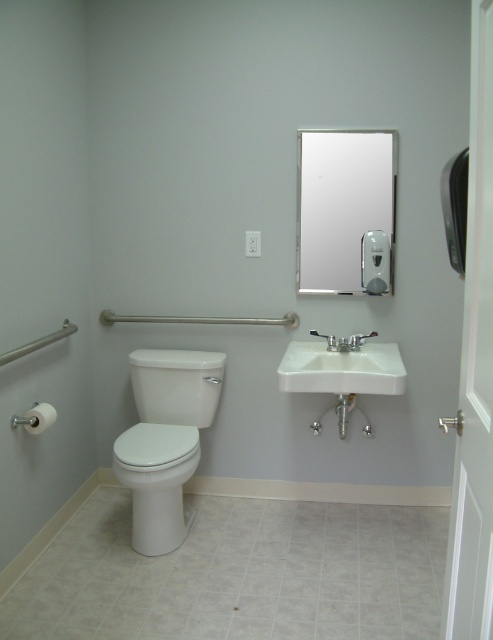
Question: Is clear glass mirror at upper center positioned before white matte toilet paper at lower left?

Choices:
 (A) yes
 (B) no

Answer: (B)

Question: In this image, where is white glossy toilet at lower left located relative to satin nickel faucet at sink right?

Choices:
 (A) right
 (B) left

Answer: (B)

Question: Which object appears closest to the camera in this image?

Choices:
 (A) silver metallic towel bar at lower left
 (B) satin nickel faucet at sink center
 (C) clear glass mirror at upper center
 (D) satin nickel faucet at sink right

Answer: (A)

Question: Which point is farther from the camera taking this photo?

Choices:
 (A) (313, 330)
 (B) (50, 419)

Answer: (A)

Question: Is white glossy toilet at lower left smaller than white matte toilet paper at lower left?

Choices:
 (A) no
 (B) yes

Answer: (A)

Question: Which of the following is the farthest from the observer?

Choices:
 (A) silver metallic towel bar at lower left
 (B) clear glass mirror at upper center

Answer: (B)